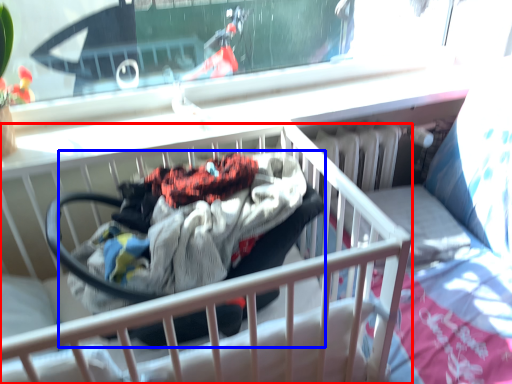
Question: Among these objects, which one is nearest to the camera, infant bed (highlighted by a red box) or baby carriage (highlighted by a blue box)?

Choices:
 (A) infant bed
 (B) baby carriage

Answer: (A)